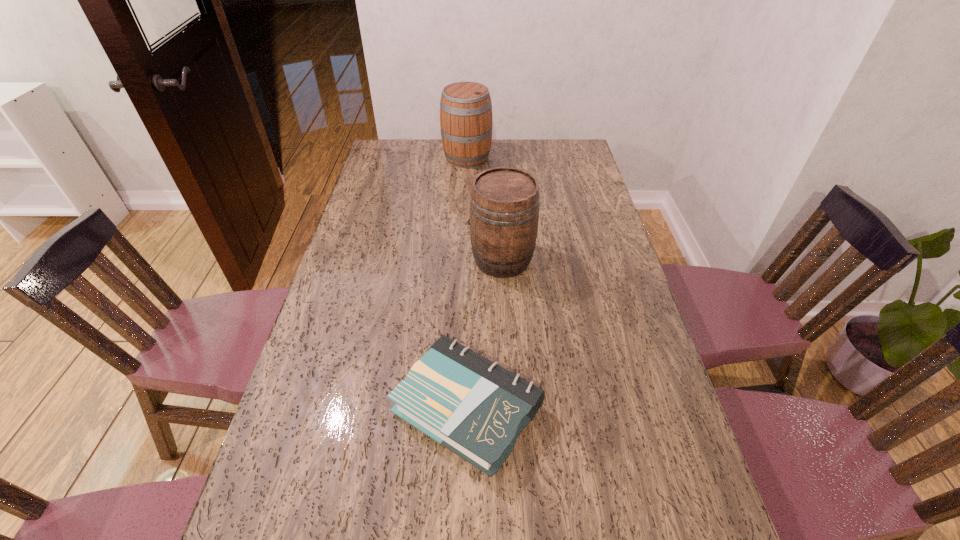
I want to click on free space at the far edge, so click(x=498, y=163).

Identify the location of free space at the left edge of the desktop. This screenshot has height=540, width=960. (369, 288).

Find the location of a particular element. The image size is (960, 540). vacant space at the right edge is located at coordinates (599, 316).

The image size is (960, 540). In order to click on free area in between the shortest object and the farthest object in this screenshot , I will do `click(468, 283)`.

This screenshot has width=960, height=540. I want to click on free space between the paperback book and the farthest object, so click(468, 283).

Locate an element on the screen. This screenshot has height=540, width=960. free space between the farther cider and the nearest object is located at coordinates (468, 283).

Identify the location of unoccupied area between the paperback book and the nearer cider. (485, 334).

Find the location of `vacant area between the second farthest object and the paperback book`. vacant area between the second farthest object and the paperback book is located at coordinates (485, 334).

Identify which object is located as the nearest to the nearer cider. Please provide its 2D coordinates. Your answer should be formatted as a tuple, i.e. [(x, y)], where the tuple contains the x and y coordinates of a point satisfying the conditions above.

[(472, 406)]

Identify which object is the closest to the nearer cider. Please provide its 2D coordinates. Your answer should be formatted as a tuple, i.e. [(x, y)], where the tuple contains the x and y coordinates of a point satisfying the conditions above.

[(472, 406)]